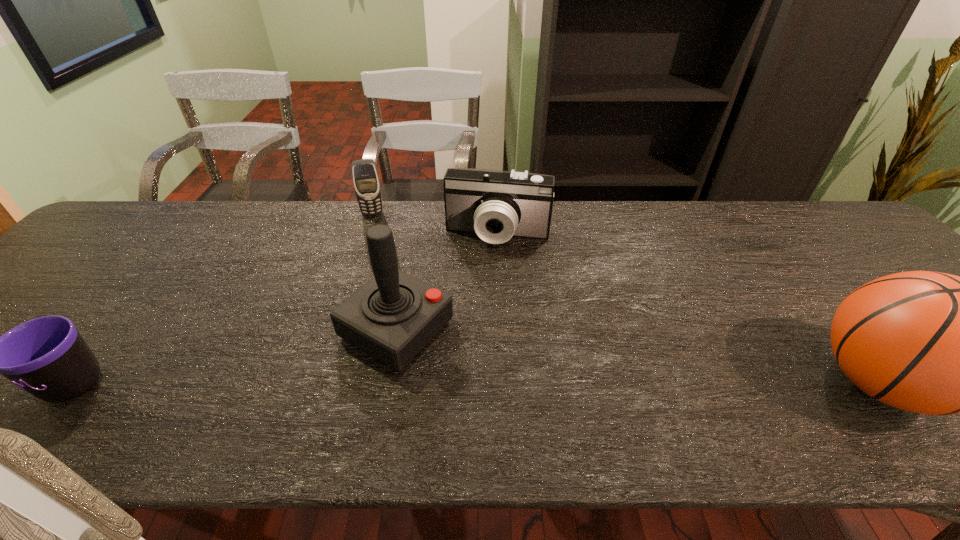
Image resolution: width=960 pixels, height=540 pixels. Find the location of `joystick`. joystick is located at coordinates (392, 317).

This screenshot has height=540, width=960. In order to click on cellular telephone in this screenshot , I will do `click(366, 181)`.

Image resolution: width=960 pixels, height=540 pixels. What are the coordinates of `the fourth nearest object` in the screenshot? It's located at (496, 205).

Find the location of a particular element. The height and width of the screenshot is (540, 960). vacant space located 0.070m on the base of the joystick is located at coordinates (468, 368).

The width and height of the screenshot is (960, 540). I want to click on vacant space located 0.170m on the base of the joystick, so click(509, 390).

At what (x,y) coordinates should I click in order to perform the action: click on vacant region located on the base of the joystick. Please return your answer as a coordinate pair (x, y). The image size is (960, 540). Looking at the image, I should click on (526, 400).

Where is `vacant space located on the front face of the farthest object`? The width and height of the screenshot is (960, 540). vacant space located on the front face of the farthest object is located at coordinates (384, 310).

Where is `free space located on the front face of the farthest object`? This screenshot has height=540, width=960. free space located on the front face of the farthest object is located at coordinates (384, 307).

Find the location of a particular element. This screenshot has height=540, width=960. free space located on the front face of the farthest object is located at coordinates (383, 304).

Locate an element on the screen. Image resolution: width=960 pixels, height=540 pixels. free space located on the lens of the second farthest object is located at coordinates (468, 361).